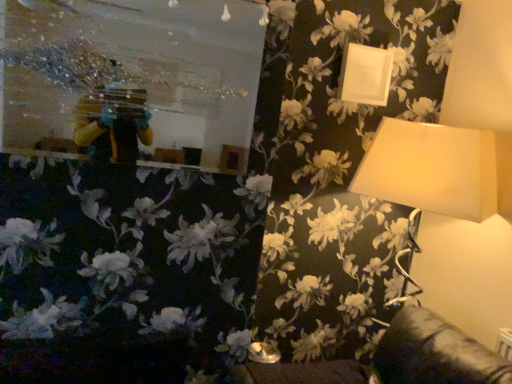
What do you see at coordinates (365, 75) in the screenshot?
I see `white matte picture frame at upper right` at bounding box center [365, 75].

The image size is (512, 384). Describe the element at coordinates (429, 176) in the screenshot. I see `matte white lampshade at upper right` at that location.

Identify the location of metallic reflective mirror at upper left. (131, 81).

In the scene shown: From a real-world perspective, between white matte picture frame at upper right and matte white lampshade at upper right, who is vertically higher?

white matte picture frame at upper right is physically above.

Consider the image. Can you confirm if white matte picture frame at upper right is shorter than matte white lampshade at upper right?

Correct, white matte picture frame at upper right is not as tall as matte white lampshade at upper right.

Considering the sizes of white matte picture frame at upper right and matte white lampshade at upper right in the image, is white matte picture frame at upper right bigger or smaller than matte white lampshade at upper right?

Considering their sizes, white matte picture frame at upper right takes up less space than matte white lampshade at upper right.

How much distance is there between metallic reflective mirror at upper left and white matte picture frame at upper right?

metallic reflective mirror at upper left and white matte picture frame at upper right are 32.17 inches apart.

Is metallic reflective mirror at upper left taller than white matte picture frame at upper right?

Yes, metallic reflective mirror at upper left is taller than white matte picture frame at upper right.

From the picture: From the image's perspective, which object appears higher, metallic reflective mirror at upper left or white matte picture frame at upper right?

white matte picture frame at upper right is shown above in the image.

Who is smaller, metallic reflective mirror at upper left or white matte picture frame at upper right?

white matte picture frame at upper right.

Considering the sizes of objects matte white lampshade at upper right and white matte picture frame at upper right in the image provided, who is taller, matte white lampshade at upper right or white matte picture frame at upper right?

matte white lampshade at upper right is taller.

From the image's perspective, is matte white lampshade at upper right located beneath white matte picture frame at upper right?

Yes, from the image's perspective, matte white lampshade at upper right is below white matte picture frame at upper right.

Is matte white lampshade at upper right not close to white matte picture frame at upper right?

Actually, matte white lampshade at upper right and white matte picture frame at upper right are a little close together.

How many degrees apart are the facing directions of matte white lampshade at upper right and white matte picture frame at upper right?

They differ by 1.34 degrees in their facing directions.

From the image's perspective, is white matte picture frame at upper right on metallic reflective mirror at upper left?

Correct, white matte picture frame at upper right appears higher than metallic reflective mirror at upper left in the image.

Is white matte picture frame at upper right not close to metallic reflective mirror at upper left?

No, there isn't a large distance between white matte picture frame at upper right and metallic reflective mirror at upper left.

Identify the location of picture frame that appears on the right of metallic reflective mirror at upper left. Image resolution: width=512 pixels, height=384 pixels. (365, 75).

Between white matte picture frame at upper right and metallic reflective mirror at upper left, which one is positioned behind?

white matte picture frame at upper right is further away from the camera.

From a real-world perspective, who is located lower, metallic reflective mirror at upper left or matte white lampshade at upper right?

matte white lampshade at upper right, from a real-world perspective.

Could you measure the distance between metallic reflective mirror at upper left and matte white lampshade at upper right?

The distance of metallic reflective mirror at upper left from matte white lampshade at upper right is 36.04 inches.

Considering the relative sizes of metallic reflective mirror at upper left and matte white lampshade at upper right in the image provided, is metallic reflective mirror at upper left shorter than matte white lampshade at upper right?

Yes.

Does point (135, 160) come closer to viewer compared to point (368, 194)?

Yes, it is in front of point (368, 194).

Are matte white lampshade at upper right and metallic reflective mirror at upper left beside each other?

No.

Is matte white lampshade at upper right not within metallic reflective mirror at upper left?

That's correct, matte white lampshade at upper right is outside of metallic reflective mirror at upper left.

How many degrees apart are the facing directions of matte white lampshade at upper right and metallic reflective mirror at upper left?

4.12 degrees separate the facing orientations of matte white lampshade at upper right and metallic reflective mirror at upper left.

You are a GUI agent. You are given a task and a screenshot of the screen. Output one action in this format:
    pyautogui.click(x=<x>, y=<y>)
    Task: Click on the picture frame that is above the matte white lampshade at upper right (from the image's perspective)
    The image size is (512, 384).
    Given the screenshot: What is the action you would take?
    pyautogui.click(x=365, y=75)

This screenshot has height=384, width=512. What are the coordinates of `picture frame behind the metallic reflective mirror at upper left` in the screenshot? It's located at (365, 75).

Considering their positions, is metallic reflective mirror at upper left positioned closer to matte white lampshade at upper right than white matte picture frame at upper right?

white matte picture frame at upper right is positioned closer to the anchor matte white lampshade at upper right.

Which object lies further to the anchor point matte white lampshade at upper right, white matte picture frame at upper right or metallic reflective mirror at upper left?

The object further to matte white lampshade at upper right is metallic reflective mirror at upper left.

Based on their spatial positions, is matte white lampshade at upper right or white matte picture frame at upper right closer to metallic reflective mirror at upper left?

Among the two, white matte picture frame at upper right is located nearer to metallic reflective mirror at upper left.

When comparing their distances from white matte picture frame at upper right, does matte white lampshade at upper right or metallic reflective mirror at upper left seem further?

Based on the image, metallic reflective mirror at upper left appears to be further to white matte picture frame at upper right.

Looking at the image, which one is located closer to white matte picture frame at upper right, metallic reflective mirror at upper left or matte white lampshade at upper right?

The object closer to white matte picture frame at upper right is matte white lampshade at upper right.

Looking at the image, which one is located closer to metallic reflective mirror at upper left, white matte picture frame at upper right or matte white lampshade at upper right?

white matte picture frame at upper right.

Find the location of a particular element. picture frame between metallic reflective mirror at upper left and matte white lampshade at upper right from left to right is located at coordinates (365, 75).